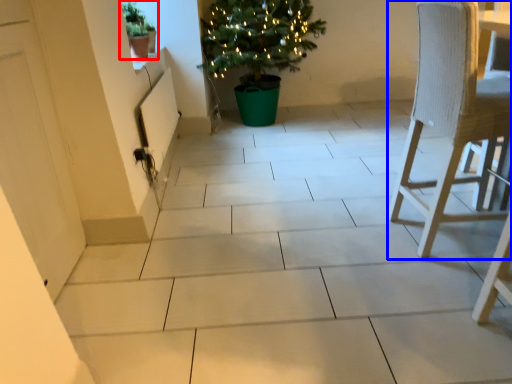
Question: Among these objects, which one is farthest to the camera, houseplant (highlighted by a red box) or chair (highlighted by a blue box)?

Choices:
 (A) houseplant
 (B) chair

Answer: (A)